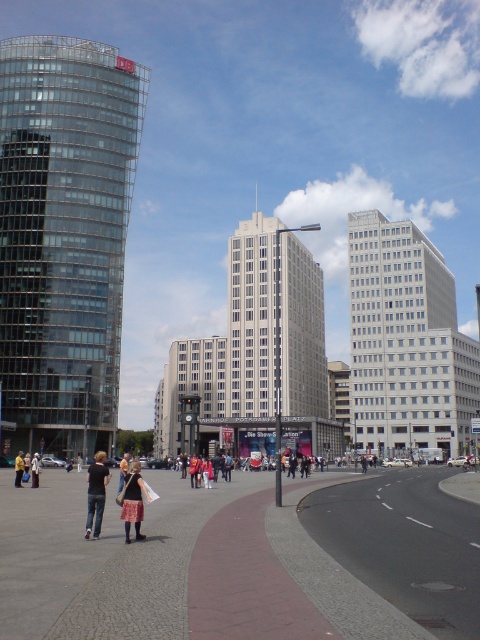
Question: Which object is positioned farthest from the glassy modern skyscraper at left?

Choices:
 (A) denim jacket at lower left
 (B) white glass building at center

Answer: (B)

Question: In this image, where is glassy modern skyscraper at left located relative to matte black jacket at lower center?

Choices:
 (A) right
 (B) left

Answer: (B)

Question: Which point is farther from the camera taking this photo?

Choices:
 (A) (271, 225)
 (B) (100, 436)
 (C) (139, 518)

Answer: (A)

Question: Estimate the real-world distances between objects in this image. Which object is closer to the white stone building at center?

Choices:
 (A) yellow fabric bag at lower center
 (B) white glass building at center
 (C) concrete sidewalk at center

Answer: (B)

Question: In this image, where is glassy modern skyscraper at left located relative to white glass building at center?

Choices:
 (A) left
 (B) right

Answer: (A)

Question: Is black cotton shirt at lower left thinner than matte black jacket at lower center?

Choices:
 (A) no
 (B) yes

Answer: (A)